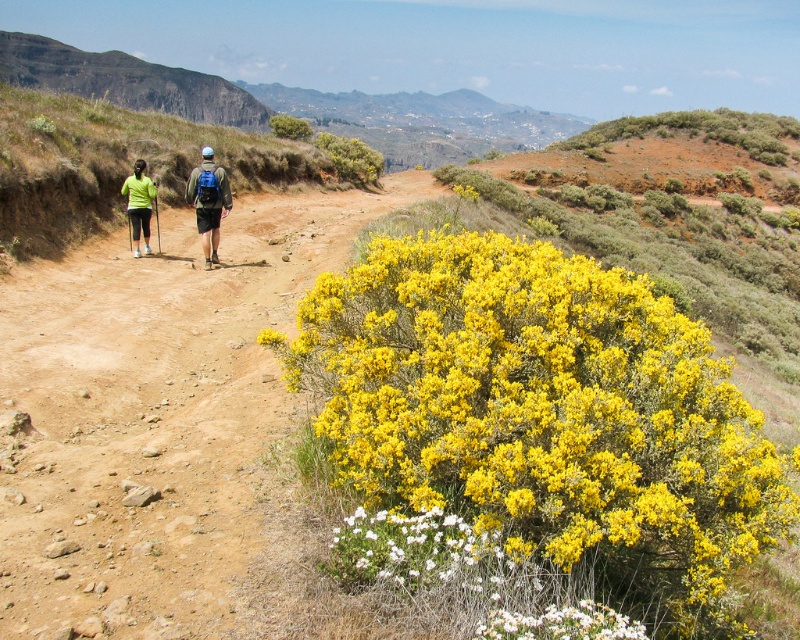
In the scene shown: You are planning to set up a temporary campsite along this hiking trail. You want to place your tent between the yellow bush at right and the matte blue backpack at center. Given that your tent requires a minimum of 10 meters of space between these two landmarks for safety, is this location suitable?

The distance between the yellow bush at right and the matte blue backpack at center is 8.82 meters, which is less than the required 10 meters. Therefore, this location is not suitable for setting up the tent.

In the scene shown: You are planning to walk along the hiking trail shown in the image. There is a yellow shrub at center and a matte black shorts at left. Which object is wider?

The yellow shrub at center is wider than the matte black shorts at left.

Based on the photo, you are a hiker on the trail and want to take a photo of the yellow bush at right and the matte blue backpack at center. To get both in the frame, should you adjust your camera to the left or right?

The yellow bush at right is to the right of the matte blue backpack at center, so you should adjust your camera to the right to include both in the frame.